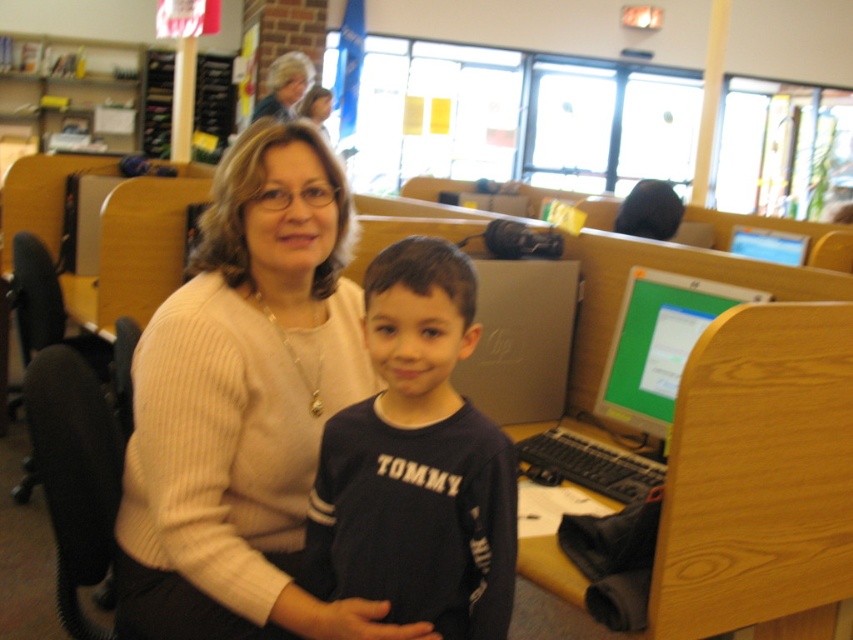
Question: Is the position of light beige sweater at center less distant than that of dark blue jersey at center?

Choices:
 (A) no
 (B) yes

Answer: (A)

Question: Estimate the real-world distances between objects in this image. Which object is farther from the silver metallic monitor at right?

Choices:
 (A) light beige sweater at center
 (B) dark blue jersey at center
 (C) green glossy monitor at upper right

Answer: (C)

Question: Can you confirm if light beige sweater at center is wider than green glossy monitor at upper right?

Choices:
 (A) yes
 (B) no

Answer: (A)

Question: Which object appears closest to the camera in this image?

Choices:
 (A) green glossy monitor at upper right
 (B) silver metallic monitor at right
 (C) light beige sweater at center

Answer: (C)

Question: Is light beige sweater at center wider than green glossy monitor at upper right?

Choices:
 (A) yes
 (B) no

Answer: (A)

Question: Which of the following is the farthest from the observer?

Choices:
 (A) green glossy monitor at upper right
 (B) dark blue jersey at center
 (C) light beige sweater at center

Answer: (A)